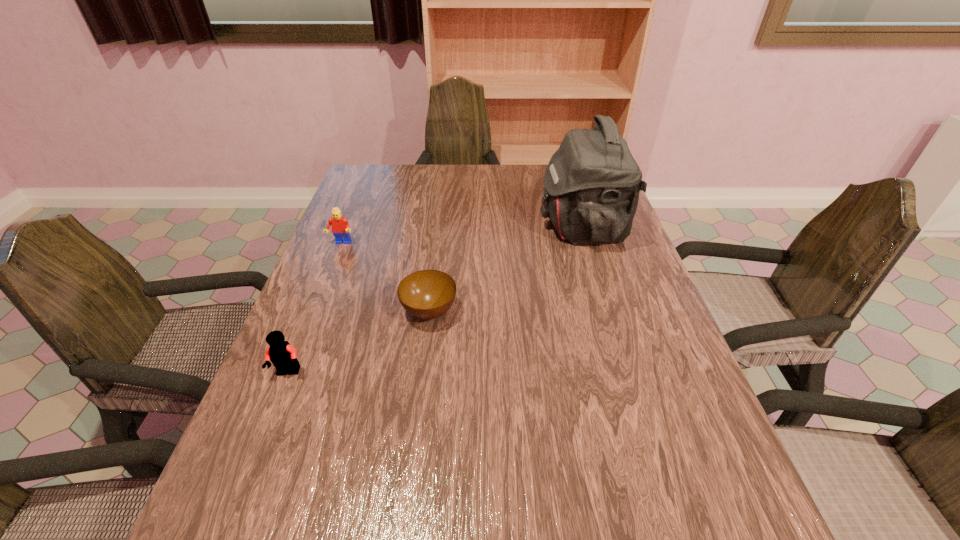
You are a GUI agent. You are given a task and a screenshot of the screen. Output one action in this format:
    pyautogui.click(x=<x>, y=<y>)
    Task: Click on the free space that is in between the rightmost object and the second object from right to left
    The width and height of the screenshot is (960, 540).
    Given the screenshot: What is the action you would take?
    pyautogui.click(x=506, y=269)

The width and height of the screenshot is (960, 540). I want to click on free space between the farther Lego and the bowl, so click(x=385, y=278).

The image size is (960, 540). What are the coordinates of `free space between the shortest object and the tallest object` in the screenshot? It's located at (x=506, y=269).

At what (x,y) coordinates should I click in order to perform the action: click on free space between the shortest object and the farther Lego. Please return your answer as a coordinate pair (x, y). Looking at the image, I should click on (385, 278).

At what (x,y) coordinates should I click in order to perform the action: click on free spot between the nearer Lego and the shortest object. Please return your answer as a coordinate pair (x, y). The image size is (960, 540). Looking at the image, I should click on (359, 342).

Identify the location of free spot between the third object from left to right and the nearest object. [x=359, y=342].

Identify the location of object that is the closest to the shoulder bag. (427, 294).

Select which object is the closest to the tallest object. Please provide its 2D coordinates. Your answer should be formatted as a tuple, i.e. [(x, y)], where the tuple contains the x and y coordinates of a point satisfying the conditions above.

[(427, 294)]

The height and width of the screenshot is (540, 960). Identify the location of free region that satisfies the following two spatial constraints: 1. on the front-facing side of the second object from right to left; 2. on the left side of the farther Lego. (314, 312).

This screenshot has width=960, height=540. Identify the location of free space that satisfies the following two spatial constraints: 1. on the open flap of the shoulder bag; 2. on the front-facing side of the farther Lego. (588, 244).